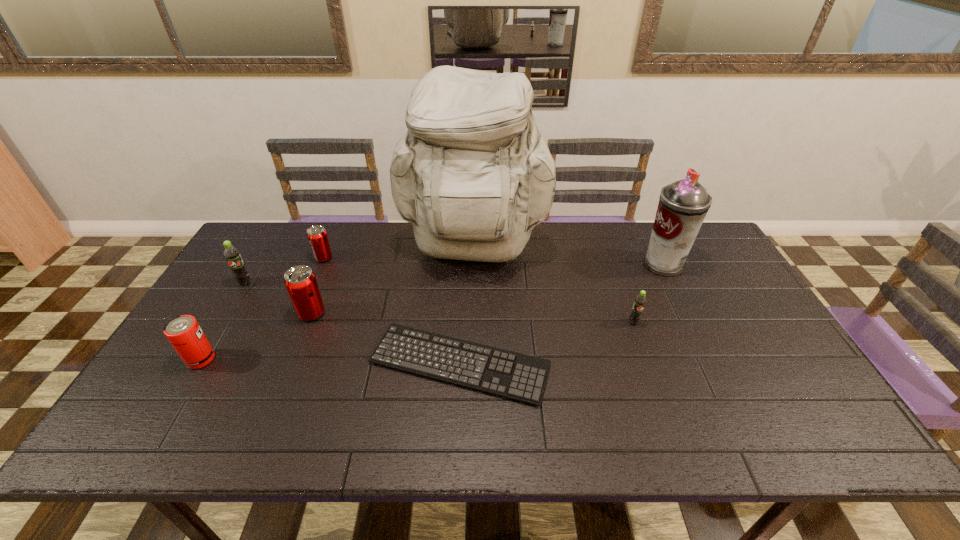
Where is `the seventh object from left to right`? The width and height of the screenshot is (960, 540). the seventh object from left to right is located at coordinates (640, 301).

Identify the location of computer keyboard. (509, 374).

You are a GUI agent. You are given a task and a screenshot of the screen. Output one action in this format:
    pyautogui.click(x=<x>, y=<y>)
    Task: Click on the black computer keyboard
    The height and width of the screenshot is (540, 960).
    Given the screenshot: What is the action you would take?
    pyautogui.click(x=509, y=374)

What are the coordinates of `vacant space located 0.150m on the front-facing side of the backpack` in the screenshot? It's located at (471, 322).

In order to click on free space located 0.050m on the right of the second tallest object in this screenshot , I will do `click(700, 264)`.

Find the location of `vacant area situated on the front label of the farther green soda`. vacant area situated on the front label of the farther green soda is located at coordinates (222, 321).

Image resolution: width=960 pixels, height=540 pixels. Identify the location of vacant area located on the right of the nearer red soda can. (466, 313).

Image resolution: width=960 pixels, height=540 pixels. What are the coordinates of `vacant space located 0.240m on the right of the can` in the screenshot? It's located at (307, 359).

Find the location of a particular element. This screenshot has height=540, width=960. vacant area located 0.180m on the front of the smaller red soda can is located at coordinates (304, 302).

The image size is (960, 540). Find the location of `vacant space situated on the front label of the rightmost soda`. vacant space situated on the front label of the rightmost soda is located at coordinates (667, 417).